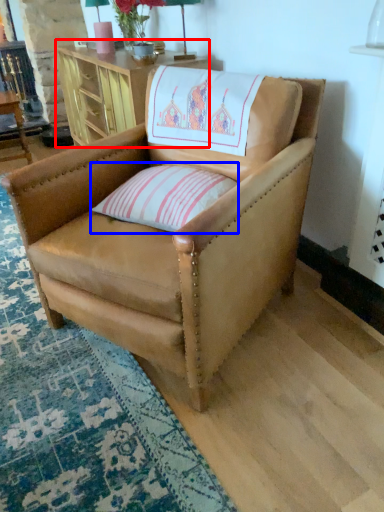
Question: Among these objects, which one is farthest to the camera, table (highlighted by a red box) or pillow (highlighted by a blue box)?

Choices:
 (A) table
 (B) pillow

Answer: (A)